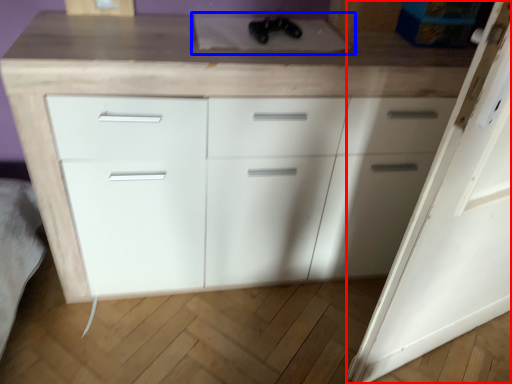
Question: Which of the following is the farthest to the observer, door (highlighted by a red box) or sink (highlighted by a blue box)?

Choices:
 (A) door
 (B) sink

Answer: (B)